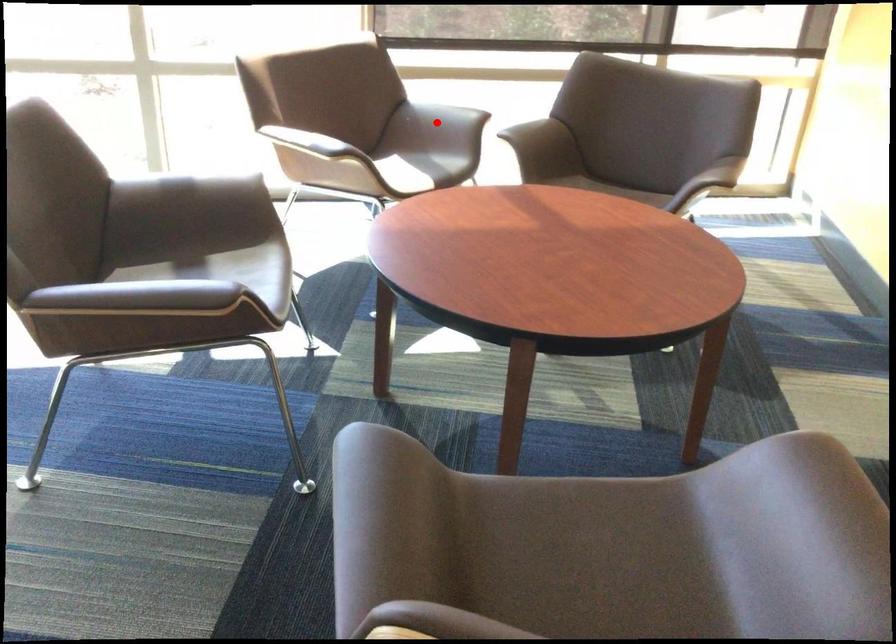
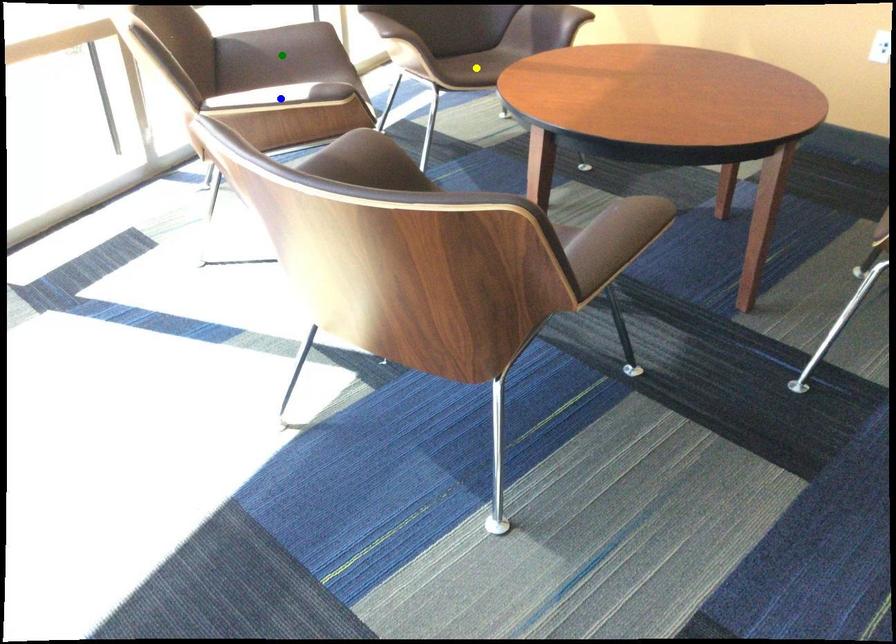
Question: I am providing you with two images of the same scene from different viewpoints. A red point is marked on the first image. You are given multiple points on the second image. Which point in image 2 represents the same 3d spot as the red point in image 1?

Choices:
 (A) yellow point
 (B) blue point
 (C) green point

Answer: (C)